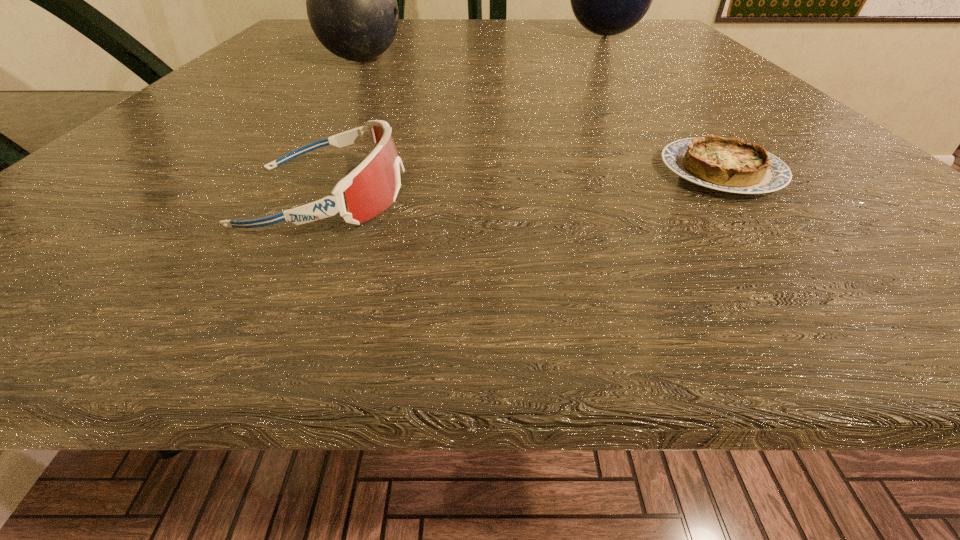
I want to click on free space located 0.130m on the front-facing side of the goggles, so click(x=541, y=195).

Locate an element on the screen. The height and width of the screenshot is (540, 960). free space located on the front of the quiche is located at coordinates (807, 272).

Locate an element on the screen. This screenshot has height=540, width=960. object that is at the far edge is located at coordinates (607, 0).

Locate an element on the screen. The width and height of the screenshot is (960, 540). object located in the near edge section of the desktop is located at coordinates (373, 185).

Identify the location of object present at the left edge. The width and height of the screenshot is (960, 540). (351, 0).

The height and width of the screenshot is (540, 960). In order to click on bowling ball at the right edge in this screenshot , I will do `click(607, 0)`.

Where is `quiche present at the right edge`? The height and width of the screenshot is (540, 960). quiche present at the right edge is located at coordinates (730, 165).

Identify the location of object positioned at the far right corner. (607, 0).

The width and height of the screenshot is (960, 540). Find the location of `vacant space at the far edge of the desktop`. vacant space at the far edge of the desktop is located at coordinates (498, 35).

Find the location of a particular element. This screenshot has width=960, height=540. vacant space at the near edge of the desktop is located at coordinates (564, 230).